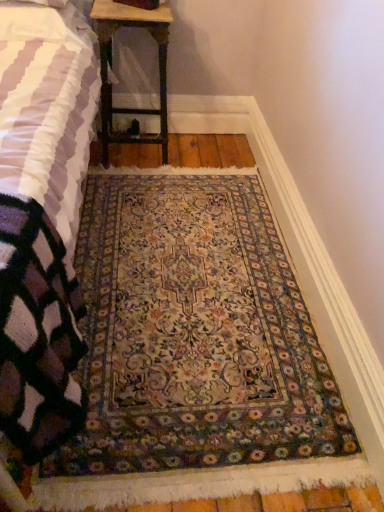
The height and width of the screenshot is (512, 384). What are the coordinates of `knitted wool blanket at lower left` in the screenshot? It's located at (42, 217).

This screenshot has width=384, height=512. I want to click on wooden table at upper center, so click(111, 62).

Does carpeted rug at center have a smaller size compared to wooden table at upper center?

Incorrect, carpeted rug at center is not smaller in size than wooden table at upper center.

Looking at this image, is carpeted rug at center oriented away from wooden table at upper center?

Absolutely, carpeted rug at center is directed away from wooden table at upper center.

How many degrees apart are the facing directions of carpeted rug at center and wooden table at upper center?

The facing directions of carpeted rug at center and wooden table at upper center are 0.234 degrees apart.

Which object is further away from the camera, carpeted rug at center or wooden table at upper center?

wooden table at upper center.

Locate an element on the screen. bed above the carpeted rug at center (from the image's perspective) is located at coordinates (42, 217).

Considering the relative sizes of carpeted rug at center and knitted wool blanket at lower left in the image provided, is carpeted rug at center bigger than knitted wool blanket at lower left?

No.

Which is in front, carpeted rug at center or knitted wool blanket at lower left?

knitted wool blanket at lower left.

Can you confirm if wooden table at upper center is positioned to the right of carpeted rug at center?

In fact, wooden table at upper center is to the left of carpeted rug at center.

Which of these two, wooden table at upper center or carpeted rug at center, stands taller?

wooden table at upper center is taller.

Is wooden table at upper center oriented away from carpeted rug at center?

No, wooden table at upper center's orientation is not away from carpeted rug at center.

Is there a large distance between wooden table at upper center and knitted wool blanket at lower left?

No.

Is point (101, 89) closer or farther from the camera than point (43, 254)?

Point (101, 89) appears to be farther away from the viewer than point (43, 254).

Is knitted wool blanket at lower left at the back of wooden table at upper center?

That's not correct — wooden table at upper center is not looking away from knitted wool blanket at lower left.

From a real-world perspective, relative to knitted wool blanket at lower left, is wooden table at upper center vertically above or below?

In terms of real-world spatial position, wooden table at upper center is below knitted wool blanket at lower left.

Which is in front, point (50, 134) or point (158, 457)?

The point (158, 457) is closer.

Between knitted wool blanket at lower left and carpeted rug at center, which one has larger size?

knitted wool blanket at lower left is bigger.

Does knitted wool blanket at lower left have a greater width compared to carpeted rug at center?

Yes.

Based on the photo, is knitted wool blanket at lower left behind carpeted rug at center?

No, knitted wool blanket at lower left is in front of carpeted rug at center.

Considering the sizes of objects knitted wool blanket at lower left and wooden table at upper center in the image provided, who is smaller, knitted wool blanket at lower left or wooden table at upper center?

With smaller size is wooden table at upper center.

From a real-world perspective, is knitted wool blanket at lower left positioned over wooden table at upper center based on gravity?

Yes, from a real-world perspective, knitted wool blanket at lower left is over wooden table at upper center

From the picture: Is knitted wool blanket at lower left aimed at wooden table at upper center?

No, knitted wool blanket at lower left is not turned towards wooden table at upper center.

Relative to wooden table at upper center, is knitted wool blanket at lower left in front or behind?

knitted wool blanket at lower left is in front of wooden table at upper center.

Locate an element on the screen. table above the carpeted rug at center (from the image's perspective) is located at coordinates (111, 62).

Locate an element on the screen. mat below the knitted wool blanket at lower left (from a real-world perspective) is located at coordinates coord(194,333).

When comparing their distances from carpeted rug at center, does wooden table at upper center or knitted wool blanket at lower left seem further?

wooden table at upper center lies further to carpeted rug at center than the other object.

Which object lies further to the anchor point wooden table at upper center, knitted wool blanket at lower left or carpeted rug at center?

carpeted rug at center is positioned further to the anchor wooden table at upper center.

Looking at the image, which one is located closer to wooden table at upper center, carpeted rug at center or knitted wool blanket at lower left?

Based on the image, knitted wool blanket at lower left appears to be nearer to wooden table at upper center.

Looking at the image, which one is located closer to carpeted rug at center, knitted wool blanket at lower left or wooden table at upper center?

knitted wool blanket at lower left.

Looking at the image, which one is located further to knitted wool blanket at lower left, carpeted rug at center or wooden table at upper center?

wooden table at upper center lies further to knitted wool blanket at lower left than the other object.

When comparing their distances from knitted wool blanket at lower left, does wooden table at upper center or carpeted rug at center seem further?

wooden table at upper center is positioned further to the anchor knitted wool blanket at lower left.

Locate an element on the screen. Image resolution: width=384 pixels, height=512 pixels. mat between knitted wool blanket at lower left and wooden table at upper center in the front-back direction is located at coordinates point(194,333).